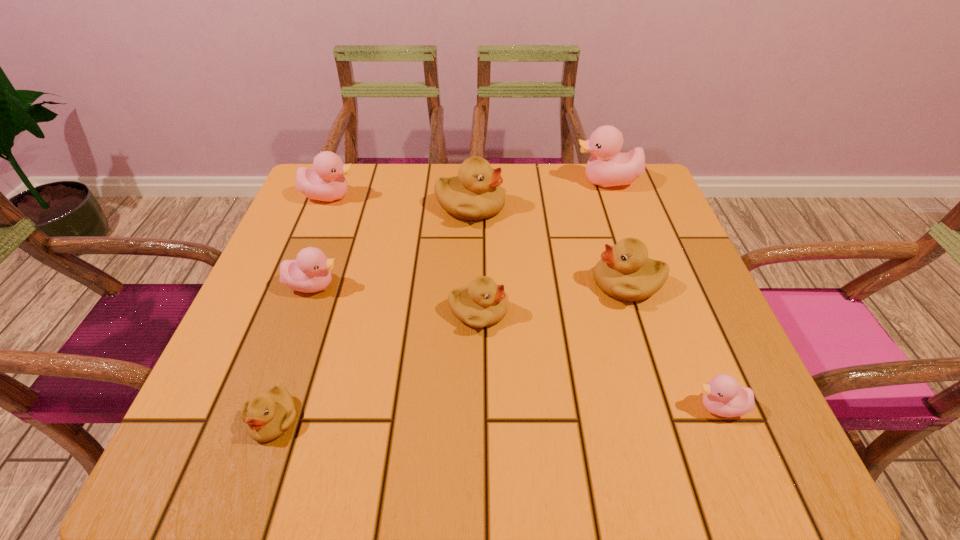
Locate an element on the screen. This screenshot has width=960, height=540. the biggest pink duckling is located at coordinates (607, 167).

In order to click on the biggest yellow duckling in this screenshot , I will do `click(474, 194)`.

What are the coordinates of `the second biggest pink duckling` in the screenshot? It's located at (326, 182).

Identify the location of the rightmost yellow duckling. This screenshot has width=960, height=540. 625,272.

You are a GUI agent. You are given a task and a screenshot of the screen. Output one action in this format:
    pyautogui.click(x=<x>, y=<y>)
    Task: Click on the third biggest pink duckling
    Image resolution: width=960 pixels, height=540 pixels.
    Given the screenshot: What is the action you would take?
    pyautogui.click(x=310, y=272)

Locate an element on the screen. The width and height of the screenshot is (960, 540). the third biggest yellow duckling is located at coordinates (482, 303).

Identify the location of the smallest pink duckling. The image size is (960, 540). (722, 396).

Where is `the leftmost yellow duckling`? The image size is (960, 540). the leftmost yellow duckling is located at coordinates (267, 416).

Locate an element on the screen. This screenshot has height=540, width=960. the nearest yellow duckling is located at coordinates (267, 416).

The image size is (960, 540). Find the location of `free space located 0.180m on the front-facing side of the biggest pink duckling`. free space located 0.180m on the front-facing side of the biggest pink duckling is located at coordinates coord(506,182).